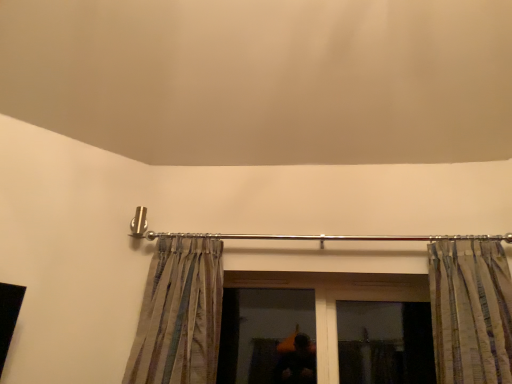
The width and height of the screenshot is (512, 384). What do you see at coordinates (179, 315) in the screenshot?
I see `silky striped curtain at left, the first curtain in the left-to-right sequence` at bounding box center [179, 315].

Identify the location of transparent glass window at center. pos(260,330).

I want to click on silky striped curtain at left, which is the 2th curtain from right to left, so coord(179,315).

From the image's perspective, is transparent glass window at center beneath striped fabric curtain at upper right, the 1th curtain positioned from the right?

Yes.

Which is in front, point (257, 351) or point (461, 279)?

The point (461, 279) is closer to the camera.

How much distance is there between transparent glass window at center and striped fabric curtain at upper right, the 1th curtain positioned from the right?

They are 35.92 inches apart.

Considering the relative positions of transparent glass window at center and striped fabric curtain at upper right, which ranks as the second curtain in left-to-right order, in the image provided, is transparent glass window at center to the left or to the right of striped fabric curtain at upper right, which ranks as the second curtain in left-to-right order,?

Based on their positions, transparent glass window at center is located to the left of striped fabric curtain at upper right, which ranks as the second curtain in left-to-right order.

Looking at their sizes, would you say silky striped curtain at left, the first curtain in the left-to-right sequence, is wider or thinner than striped fabric curtain at upper right, which ranks as the second curtain in left-to-right order?

Considering their sizes, silky striped curtain at left, the first curtain in the left-to-right sequence, looks slimmer than striped fabric curtain at upper right, which ranks as the second curtain in left-to-right order.

Is silky striped curtain at left, the first curtain in the left-to-right sequence, in contact with striped fabric curtain at upper right, the 1th curtain positioned from the right?

No, silky striped curtain at left, the first curtain in the left-to-right sequence, is not next to striped fabric curtain at upper right, the 1th curtain positioned from the right.

Is point (169, 357) positioned after point (478, 261)?

That is False.

From the picture: Which of these two, striped fabric curtain at upper right, which ranks as the second curtain in left-to-right order, or transparent glass window at center, is thinner?

With smaller width is transparent glass window at center.

Is striped fabric curtain at upper right, the 1th curtain positioned from the right, looking in the opposite direction of transparent glass window at center?

No, transparent glass window at center is not at the back of striped fabric curtain at upper right, the 1th curtain positioned from the right.

From the image's perspective, is striped fabric curtain at upper right, the 1th curtain positioned from the right, located above or below transparent glass window at center?

Based on their image positions, striped fabric curtain at upper right, the 1th curtain positioned from the right, is located above transparent glass window at center.

Between striped fabric curtain at upper right, the 1th curtain positioned from the right, and transparent glass window at center, which one appears on the right side from the viewer's perspective?

Positioned to the right is striped fabric curtain at upper right, the 1th curtain positioned from the right.

Does transparent glass window at center have a lesser width compared to silky striped curtain at left, which is the 2th curtain from right to left?

Correct, the width of transparent glass window at center is less than that of silky striped curtain at left, which is the 2th curtain from right to left.

Is point (228, 310) closer or farther from the camera than point (187, 352)?

Point (228, 310) appears to be farther away from the viewer than point (187, 352).

Consider the image. Is transparent glass window at center with silky striped curtain at left, the first curtain in the left-to-right sequence?

No, transparent glass window at center is not touching silky striped curtain at left, the first curtain in the left-to-right sequence.

In the image, is transparent glass window at center positioned in front of or behind silky striped curtain at left, which is the 2th curtain from right to left?

Visually, transparent glass window at center is located behind silky striped curtain at left, which is the 2th curtain from right to left.

Based on the photo, is striped fabric curtain at upper right, which ranks as the second curtain in left-to-right order, oriented away from silky striped curtain at left, which is the 2th curtain from right to left?

striped fabric curtain at upper right, which ranks as the second curtain in left-to-right order, is not turned away from silky striped curtain at left, which is the 2th curtain from right to left.

At what (x,y) coordinates should I click in order to perform the action: click on curtain above the silky striped curtain at left, which is the 2th curtain from right to left (from the image's perspective). Please return your answer as a coordinate pair (x, y). The width and height of the screenshot is (512, 384). Looking at the image, I should click on (471, 311).

Looking at this image, is striped fabric curtain at upper right, which ranks as the second curtain in left-to-right order, taller or shorter than silky striped curtain at left, the first curtain in the left-to-right sequence?

striped fabric curtain at upper right, which ranks as the second curtain in left-to-right order, is shorter than silky striped curtain at left, the first curtain in the left-to-right sequence.

Which is in front, silky striped curtain at left, which is the 2th curtain from right to left, or transparent glass window at center?

Positioned in front is silky striped curtain at left, which is the 2th curtain from right to left.

Is silky striped curtain at left, the first curtain in the left-to-right sequence, looking in the opposite direction of transparent glass window at center?

No, transparent glass window at center is not at the back of silky striped curtain at left, the first curtain in the left-to-right sequence.

Based on the photo, which is correct: silky striped curtain at left, the first curtain in the left-to-right sequence, is inside transparent glass window at center, or outside of it?

silky striped curtain at left, the first curtain in the left-to-right sequence, is not inside transparent glass window at center, it's outside.

Where is `window on the left of striped fabric curtain at upper right, which ranks as the second curtain in left-to-right order`? The image size is (512, 384). window on the left of striped fabric curtain at upper right, which ranks as the second curtain in left-to-right order is located at coordinates (260, 330).

Locate an element on the screen. The width and height of the screenshot is (512, 384). curtain above the silky striped curtain at left, which is the 2th curtain from right to left (from the image's perspective) is located at coordinates (471, 311).

Consider the image. When comparing their distances from silky striped curtain at left, which is the 2th curtain from right to left, does transparent glass window at center or striped fabric curtain at upper right, the 1th curtain positioned from the right, seem closer?

Among the two, transparent glass window at center is located nearer to silky striped curtain at left, which is the 2th curtain from right to left.

Estimate the real-world distances between objects in this image. Which object is further from striped fabric curtain at upper right, the 1th curtain positioned from the right, transparent glass window at center or silky striped curtain at left, which is the 2th curtain from right to left?

silky striped curtain at left, which is the 2th curtain from right to left, is further to striped fabric curtain at upper right, the 1th curtain positioned from the right.

When comparing their distances from silky striped curtain at left, the first curtain in the left-to-right sequence, does striped fabric curtain at upper right, the 1th curtain positioned from the right, or transparent glass window at center seem further?

Among the two, striped fabric curtain at upper right, the 1th curtain positioned from the right, is located further to silky striped curtain at left, the first curtain in the left-to-right sequence.

Based on the photo, based on their spatial positions, is silky striped curtain at left, which is the 2th curtain from right to left, or striped fabric curtain at upper right, the 1th curtain positioned from the right, further from transparent glass window at center?

striped fabric curtain at upper right, the 1th curtain positioned from the right, lies further to transparent glass window at center than the other object.

When comparing their distances from transparent glass window at center, does striped fabric curtain at upper right, which ranks as the second curtain in left-to-right order, or silky striped curtain at left, which is the 2th curtain from right to left, seem closer?

silky striped curtain at left, which is the 2th curtain from right to left, lies closer to transparent glass window at center than the other object.

Which object lies further to the anchor point striped fabric curtain at upper right, the 1th curtain positioned from the right, silky striped curtain at left, which is the 2th curtain from right to left, or transparent glass window at center?

silky striped curtain at left, which is the 2th curtain from right to left, lies further to striped fabric curtain at upper right, the 1th curtain positioned from the right, than the other object.

You are a GUI agent. You are given a task and a screenshot of the screen. Output one action in this format:
    pyautogui.click(x=<x>, y=<y>)
    Task: Click on the window between silky striped curtain at left, which is the 2th curtain from right to left, and striped fabric curtain at upper right, the 1th curtain positioned from the right
    The width and height of the screenshot is (512, 384).
    Given the screenshot: What is the action you would take?
    pyautogui.click(x=260, y=330)